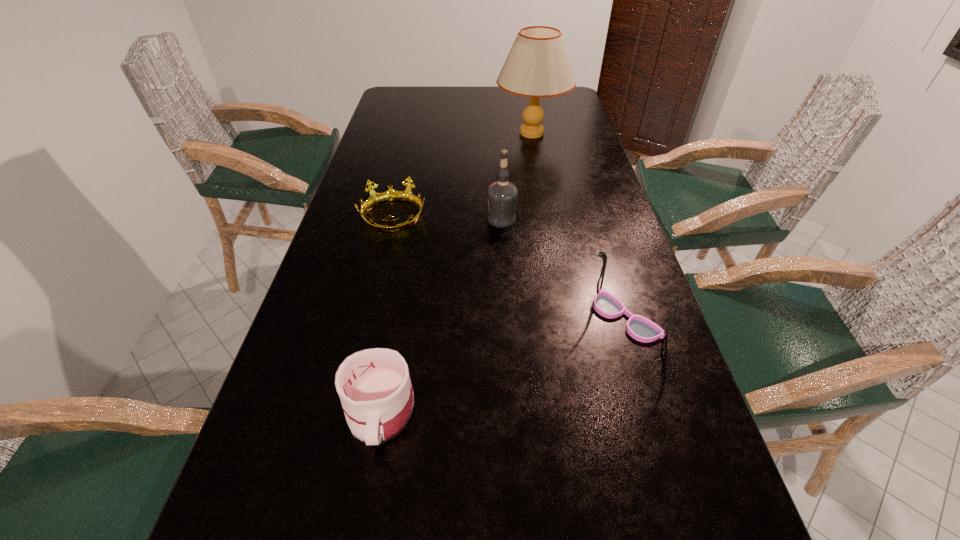
I want to click on free point located on the front label of the second tallest object, so click(x=336, y=219).

Image resolution: width=960 pixels, height=540 pixels. In order to click on free space located on the front label of the second tallest object in this screenshot , I will do `click(359, 219)`.

You are a GUI agent. You are given a task and a screenshot of the screen. Output one action in this format:
    pyautogui.click(x=<x>, y=<y>)
    Task: Click on the free region located 0.060m on the front of the fourth farthest object
    
    Given the screenshot: What is the action you would take?
    tap(642, 373)

Identify the location of free space located on the side with the handle of the mug. [x=364, y=504].

Where is `free region located on the left of the crown`? Image resolution: width=960 pixels, height=540 pixels. free region located on the left of the crown is located at coordinates (342, 217).

Where is `mug positioned at the left edge`? The height and width of the screenshot is (540, 960). mug positioned at the left edge is located at coordinates click(x=374, y=386).

Locate an element on the screen. crown that is at the left edge is located at coordinates click(x=375, y=198).

Identify the location of lampshade at the right edge. The width and height of the screenshot is (960, 540). (537, 66).

Image resolution: width=960 pixels, height=540 pixels. Find the location of `spectacles located in the right edge section of the desktop`. spectacles located in the right edge section of the desktop is located at coordinates (640, 328).

Find the location of a particular element. blank space at the far edge is located at coordinates (439, 87).